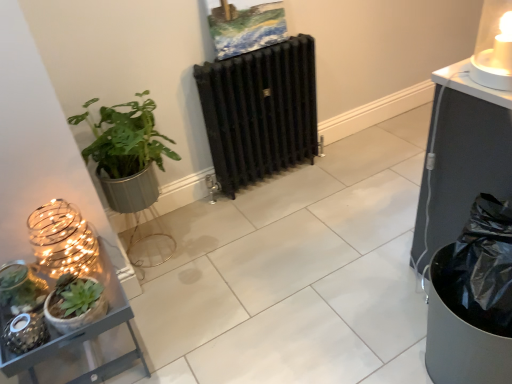
The image size is (512, 384). I want to click on vacant space underneath black cast iron radiator at center (from a real-world perspective), so click(x=275, y=171).